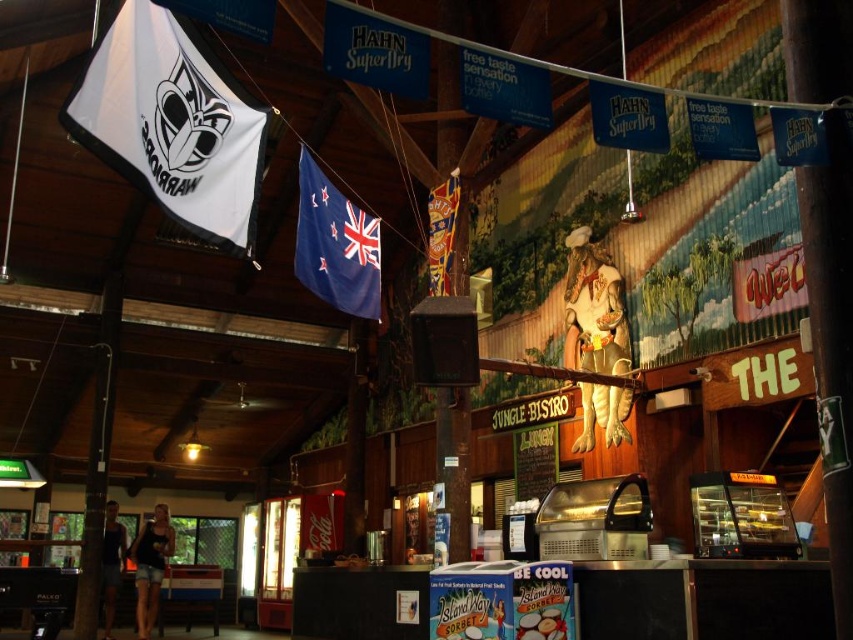
You are a customer at the Jungle Bistro and want to take a photo of the blue fabric flag at upper center. The restaurant has a policy that photos must be taken from a specific angle to ensure the flag is centered in the frame. If you stand directly in front of the flag, will the flag be centered in your photo?

The blue fabric flag at upper center is positioned at point (335, 244), so standing directly in front of it would center it in the photo.

You are a customer sitting at a table in the Jungle Bistro. You notice a white fabric flag at upper left hanging from the ceiling. Can you estimate its position relative to the center of the room?

The white fabric flag at upper left is located at coordinates approximately 0.195 on the x and 0.203 on the y axis, which places it near the upper left corner of the room, far from the center.

Based on the photo, you are standing at the entrance of the Jungle Bistro and want to take a photo of the point at coordinates point (187,49). Your camera has a maximum focus range of 4 meters. Will the camera be able to focus on the point?

The distance of point (187,49) from camera is 3.98 meters, which is within the camera maximum focus range of 4 meters. Therefore, the camera will be able to focus on the point.